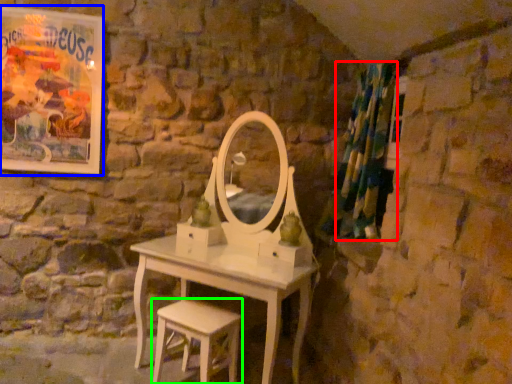
Question: Based on their relative distances, which object is farther from shower curtain (highlighted by a red box)? Choose from poster page (highlighted by a blue box) and stool (highlighted by a green box).

Choices:
 (A) poster page
 (B) stool

Answer: (A)